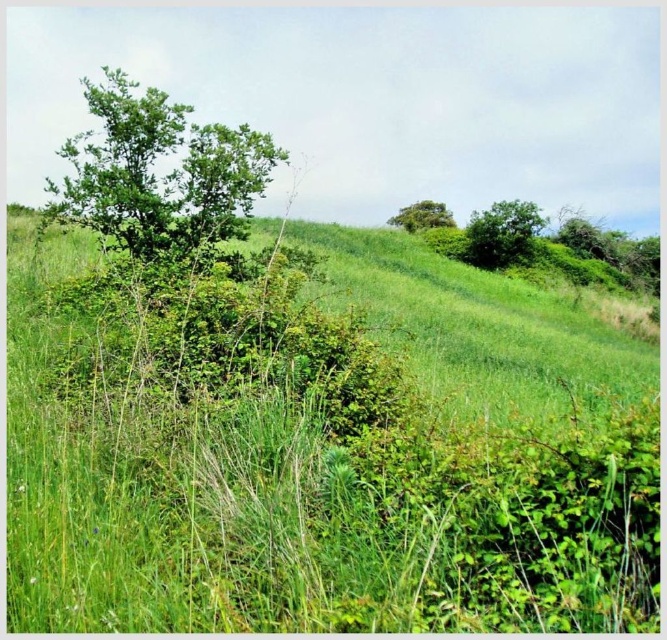
Can you confirm if green grassy at center is positioned to the left of green leafy tree at upper center?

Indeed, green grassy at center is positioned on the left side of green leafy tree at upper center.

Which is below, green grassy at center or green leafy tree at upper center?

Positioned lower is green grassy at center.

Which is in front, point (464, 508) or point (408, 209)?

Positioned in front is point (464, 508).

I want to click on green grassy at center, so click(279, 474).

Is green grassy at center closer to camera compared to green leafy tree at upper left?

Yes, green grassy at center is in front of green leafy tree at upper left.

Where is `green grassy at center`? green grassy at center is located at coordinates (279, 474).

Is green leafy tree at upper left thinner than green leafy tree at upper center?

Indeed, green leafy tree at upper left has a lesser width compared to green leafy tree at upper center.

Which is more to the left, green leafy tree at upper left or green leafy tree at upper center?

green leafy tree at upper left

Is point (161, 198) closer to viewer compared to point (408, 230)?

Yes, point (161, 198) is closer to viewer.

You are a GUI agent. You are given a task and a screenshot of the screen. Output one action in this format:
    pyautogui.click(x=<x>, y=<y>)
    Task: Click on the green leafy tree at upper left
    
    Given the screenshot: What is the action you would take?
    pyautogui.click(x=161, y=177)